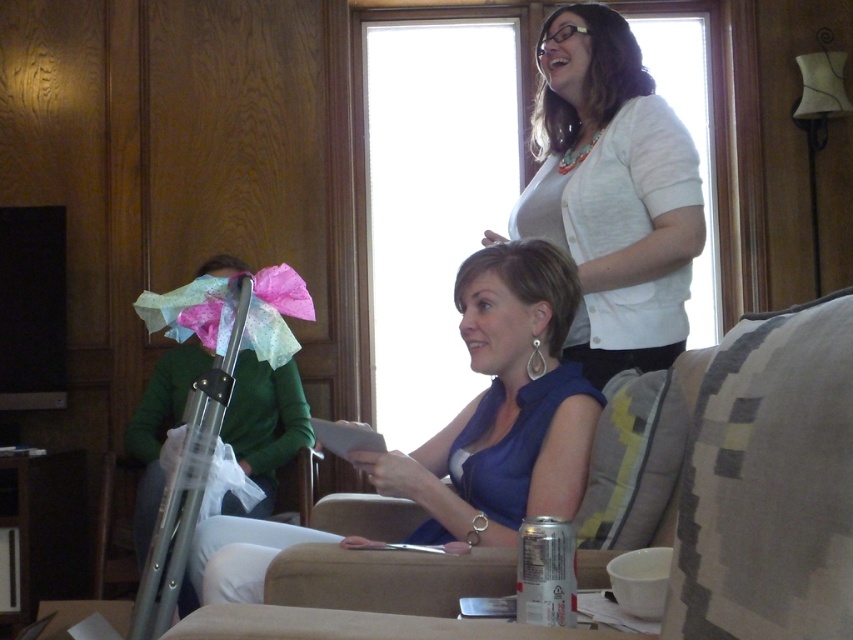
The width and height of the screenshot is (853, 640). What do you see at coordinates (503, 406) in the screenshot?
I see `blue fabric dress at center` at bounding box center [503, 406].

Between blue fabric dress at center and green fabric shirt at left, which one is positioned lower?

green fabric shirt at left

Describe the element at coordinates (503, 406) in the screenshot. The width and height of the screenshot is (853, 640). I see `blue fabric dress at center` at that location.

Locate an element on the screen. blue fabric dress at center is located at coordinates (503, 406).

Who is more distant from viewer, (532,180) or (195,348)?

Point (195,348)

Is white matte cardigan at upper center positioned before green fabric shirt at left?

→ Yes, white matte cardigan at upper center is closer to the viewer.

At what (x,y) coordinates should I click in order to perform the action: click on white matte cardigan at upper center. Please return your answer as a coordinate pair (x, y). This screenshot has width=853, height=640. Looking at the image, I should click on (612, 193).

Who is more forward, (590, 186) or (512, 381)?

Positioned in front is point (512, 381).

Find the location of a particular element. This screenshot has height=640, width=853. white matte cardigan at upper center is located at coordinates pos(612,193).